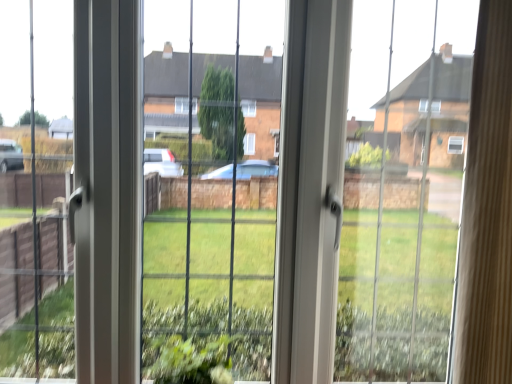
You are a GUI agent. You are given a task and a screenshot of the screen. Output one action in this format:
    pyautogui.click(x=<x>, y=<y>)
    Task: Click on the green leafy hedge at center
    This screenshot has height=384, width=512.
    Given the screenshot: What is the action you would take?
    pyautogui.click(x=206, y=342)

The width and height of the screenshot is (512, 384). What do you see at coordinates (206, 342) in the screenshot?
I see `green leafy hedge at center` at bounding box center [206, 342].

Measure the distance between green leafy hedge at center and camera.

green leafy hedge at center is 38.42 inches away from camera.

What are the coordinates of `green leafy hedge at center` in the screenshot? It's located at (206, 342).